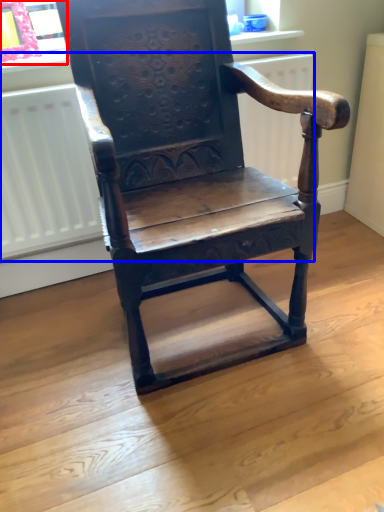
Question: Among these objects, which one is nearest to the camera, window frame (highlighted by a red box) or radiator (highlighted by a blue box)?

Choices:
 (A) window frame
 (B) radiator

Answer: (B)